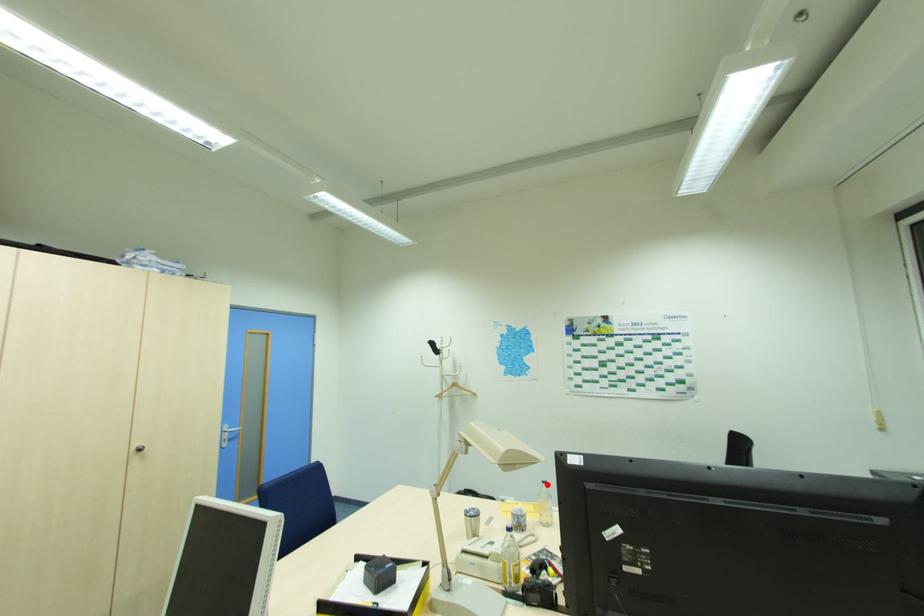
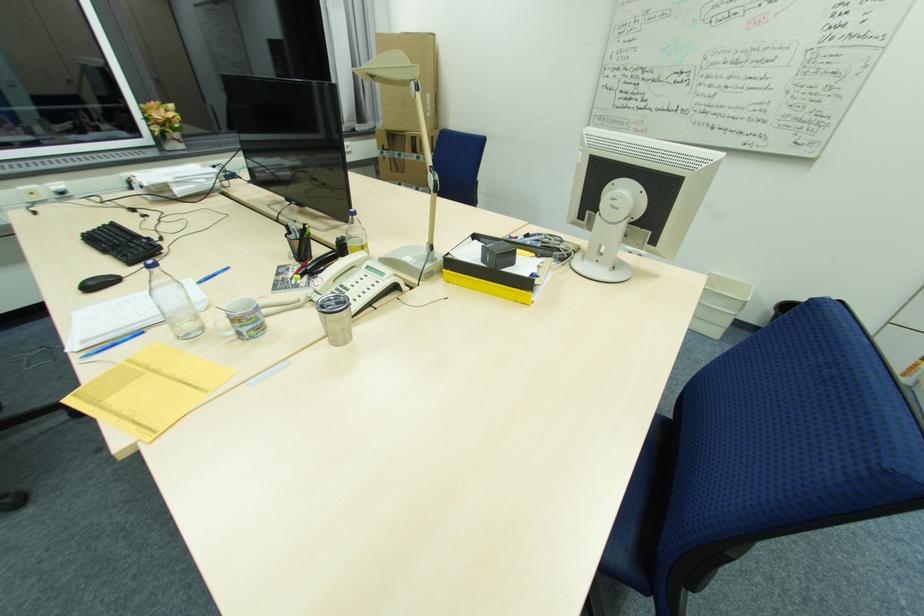
Question: I am providing you with two images of the same scene from different viewpoints. Image1 has a red point marked. In image2, the corresponding 3D location appears at what relative position? Reply with the corresponding letter.

Choices:
 (A) Closer
 (B) Farther

Answer: (A)